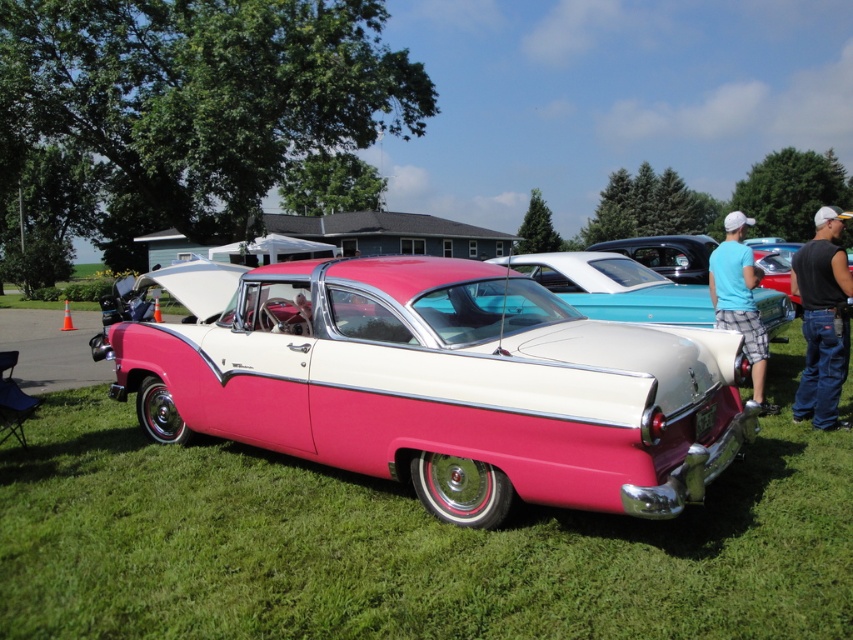
Which is in front, point (793, 417) or point (751, 257)?

Point (793, 417)

Who is more distant from viewer, (811, 339) or (758, 330)?

Point (758, 330)

Who is more distant from viewer, (839,248) or (743,252)?

Positioned behind is point (743,252).

Locate an element on the screen. black sleeveless shirt at right is located at coordinates (822, 321).

Can you confirm if pink glossy car at center is positioned to the right of blue cotton shirt at right?

Incorrect, pink glossy car at center is not on the right side of blue cotton shirt at right.

Is point (335, 426) more distant than point (764, 353)?

No, it is not.

What are the coordinates of `pink glossy car at center` in the screenshot? It's located at (445, 387).

Is pink glossy car at center smaller than black sleeveless shirt at right?

Incorrect, pink glossy car at center is not smaller in size than black sleeveless shirt at right.

Is pink glossy car at center below black sleeveless shirt at right?

Indeed, pink glossy car at center is positioned under black sleeveless shirt at right.

Looking at this image, who is more forward, (537, 346) or (843, 310)?

Point (537, 346)

The height and width of the screenshot is (640, 853). I want to click on pink glossy car at center, so click(445, 387).